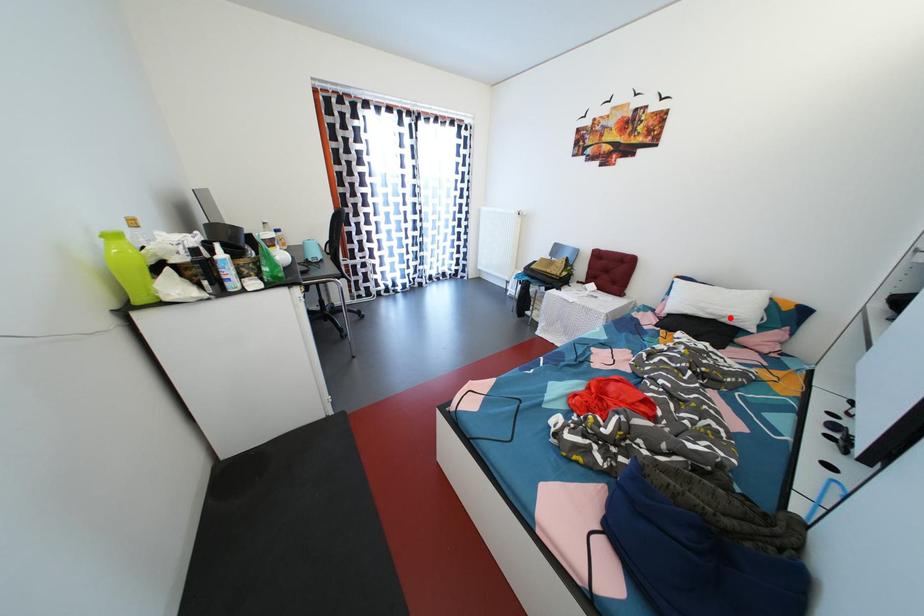
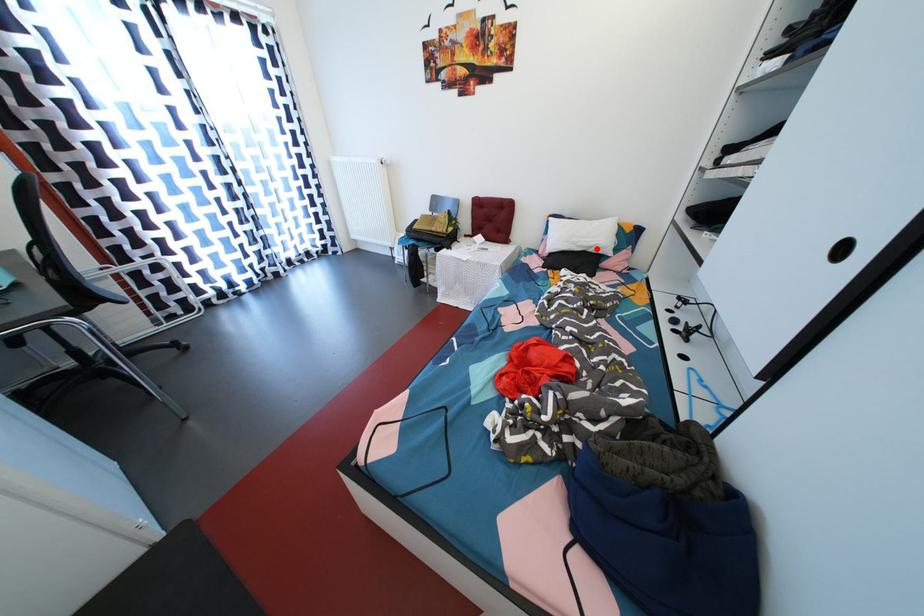
I am providing you with two images of the same scene from different viewpoints. A red point is marked on the first image and another point is marked on the second image. Is the marked point in image1 the same physical position as the marked point in image2?

Yes